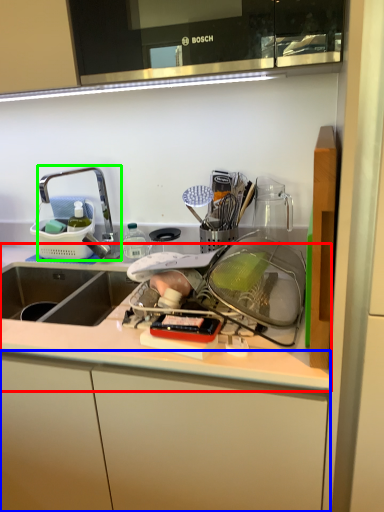
Question: Estimate the real-world distances between objects in this image. Which object is closer to countertop (highlighted by a red box), cabinetry (highlighted by a blue box) or tap (highlighted by a green box)?

Choices:
 (A) cabinetry
 (B) tap

Answer: (A)